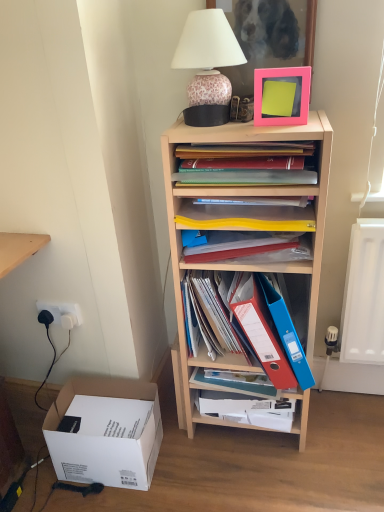
Locate an element on the screen. The width and height of the screenshot is (384, 512). vacant area that is in front of pink matte picture frame at upper center, arranged as the 2th picture frame when ordered from the bottom is located at coordinates (268, 124).